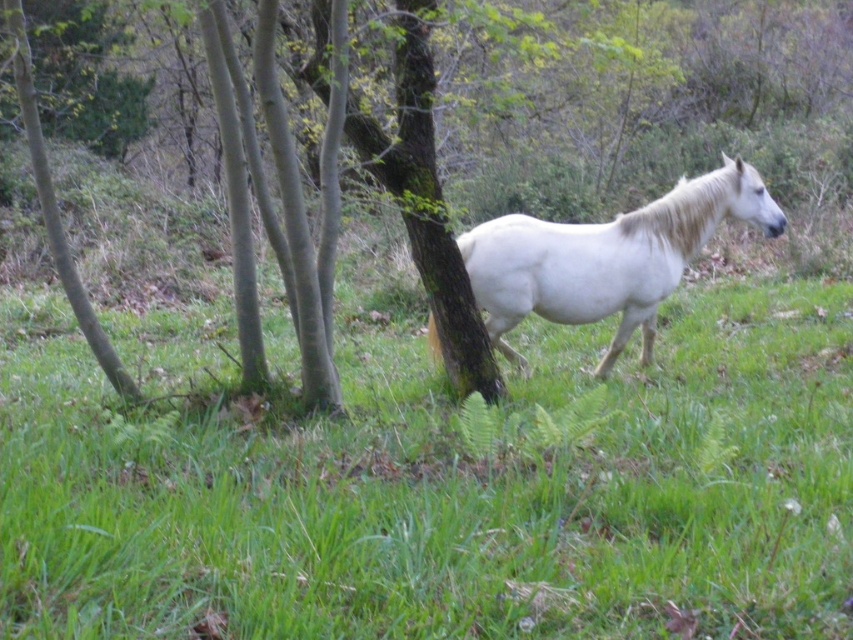
Question: Estimate the real-world distances between objects in this image. Which object is farther from the green grass at center?

Choices:
 (A) white matte horse at center
 (B) brown rough tree at center

Answer: (B)

Question: Which object is the farthest from the white matte horse at center?

Choices:
 (A) brown rough tree at center
 (B) green grass at center

Answer: (A)

Question: Considering the relative positions of brown rough tree at center and white matte horse at center in the image provided, where is brown rough tree at center located with respect to white matte horse at center?

Choices:
 (A) below
 (B) above

Answer: (B)

Question: Which point is closer to the camera?

Choices:
 (A) (543, 301)
 (B) (624, 182)

Answer: (A)

Question: Does green grass at center have a larger size compared to white matte horse at center?

Choices:
 (A) yes
 (B) no

Answer: (B)

Question: Is green grass at center to the right of white matte horse at center from the viewer's perspective?

Choices:
 (A) yes
 (B) no

Answer: (B)